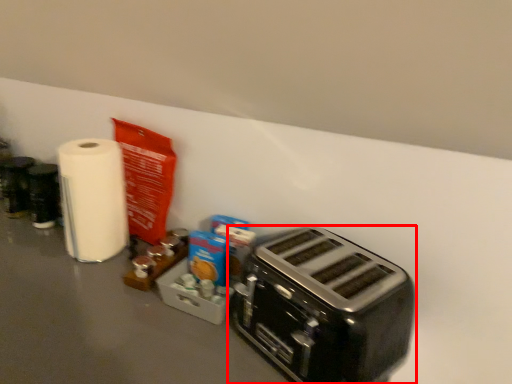
Question: In this image, where is toaster (annotated by the red box) located relative to paper towel?

Choices:
 (A) left
 (B) right

Answer: (B)